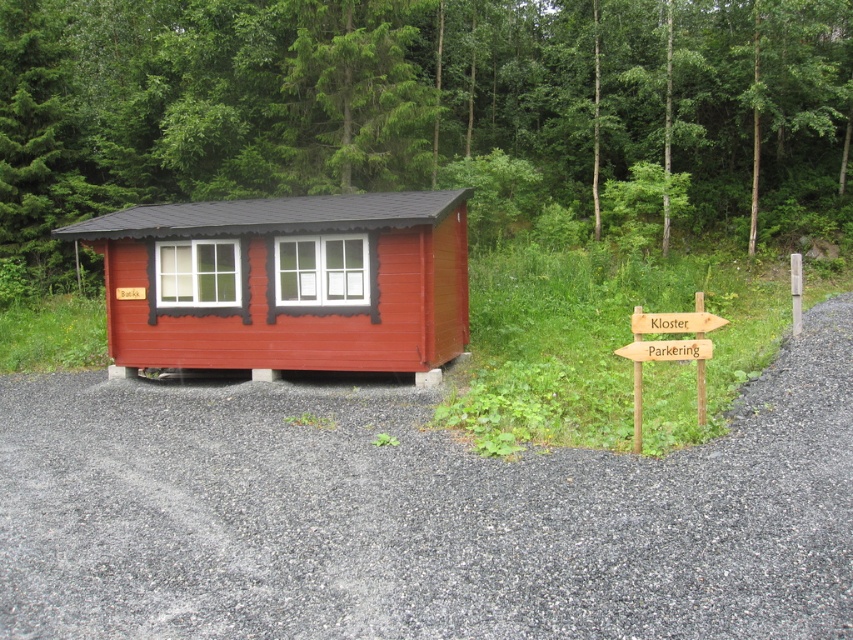
You are planning to place a new bench between the green leafy tree at upper center and the wooden signpost at lower right. Based on their widths, which object should you position closer to the narrower one to ensure the bench fits comfortably?

The wooden signpost at lower right is narrower than the green leafy tree at upper center, so you should position the bench closer to the wooden signpost at lower right to ensure it fits comfortably.